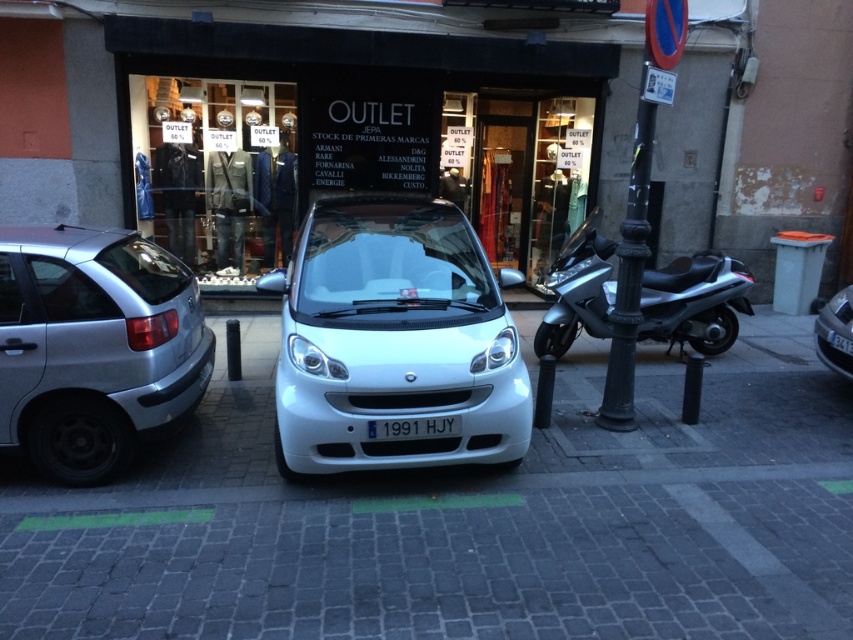
Question: Which object is the farthest from the dark gray metal pole at right?

Choices:
 (A) white glossy car at center
 (B) shiny black helmet at right
 (C) white plastic license plate at center
 (D) metallic silver scooter at right

Answer: (B)

Question: Can you confirm if white glossy car at center is positioned to the left of dark gray metal pole at right?

Choices:
 (A) yes
 (B) no

Answer: (A)

Question: Among these points, which one is farthest from the camera?

Choices:
 (A) (376, 420)
 (B) (461, 372)

Answer: (B)

Question: Estimate the real-world distances between objects in this image. Which object is farther from the white plastic license plate at center?

Choices:
 (A) metallic silver scooter at right
 (B) shiny black helmet at right
 (C) dark gray metal pole at right
 (D) silver metallic hatchback at left

Answer: (B)

Question: In this image, where is shiny black helmet at right located relative to white plastic license plate at center?

Choices:
 (A) left
 (B) right

Answer: (B)

Question: Does white glossy car at center appear over shiny black helmet at right?

Choices:
 (A) yes
 (B) no

Answer: (A)